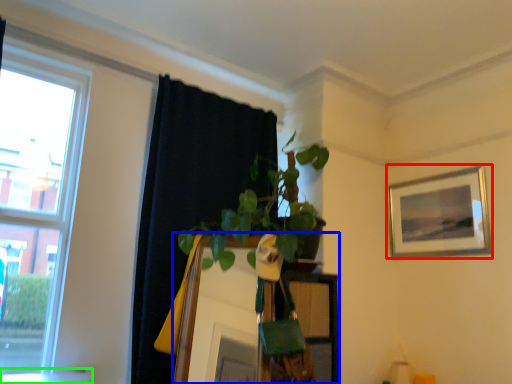
Question: Which object is the farthest from picture frame (highlighted by a red box)? Choose among these: mirror (highlighted by a blue box) or window sill (highlighted by a green box).

Choices:
 (A) mirror
 (B) window sill

Answer: (B)